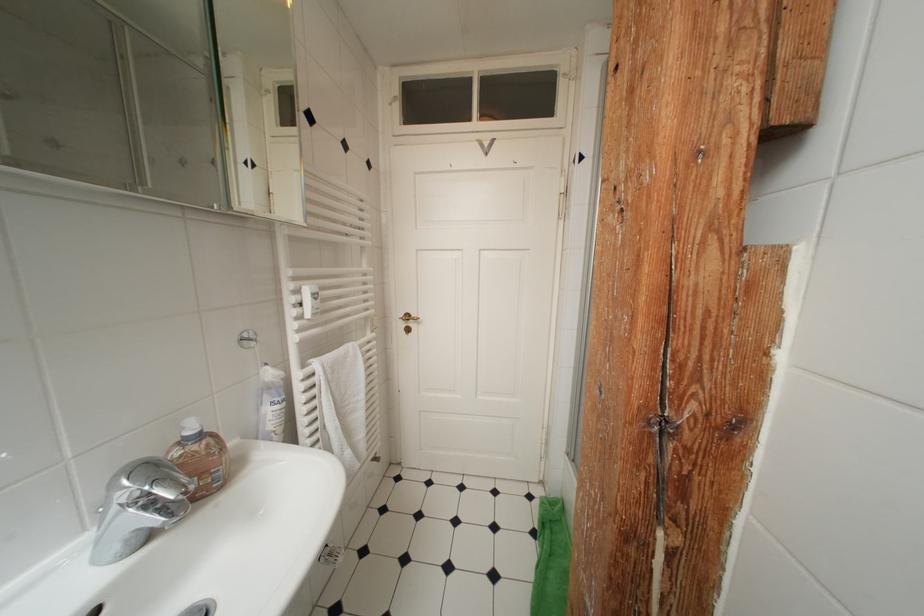
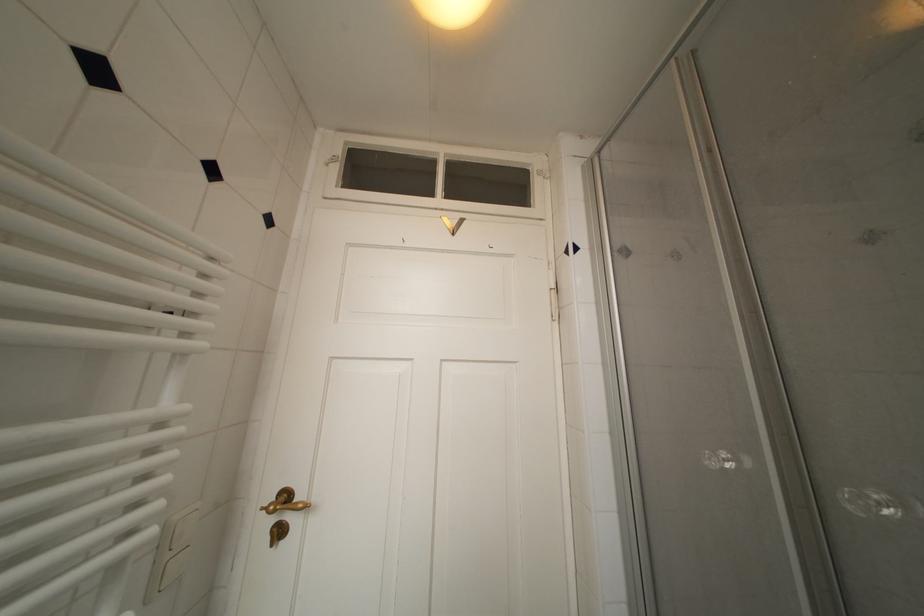
Find the pixel in the second image that matches point 415,320 in the first image.

(293, 500)